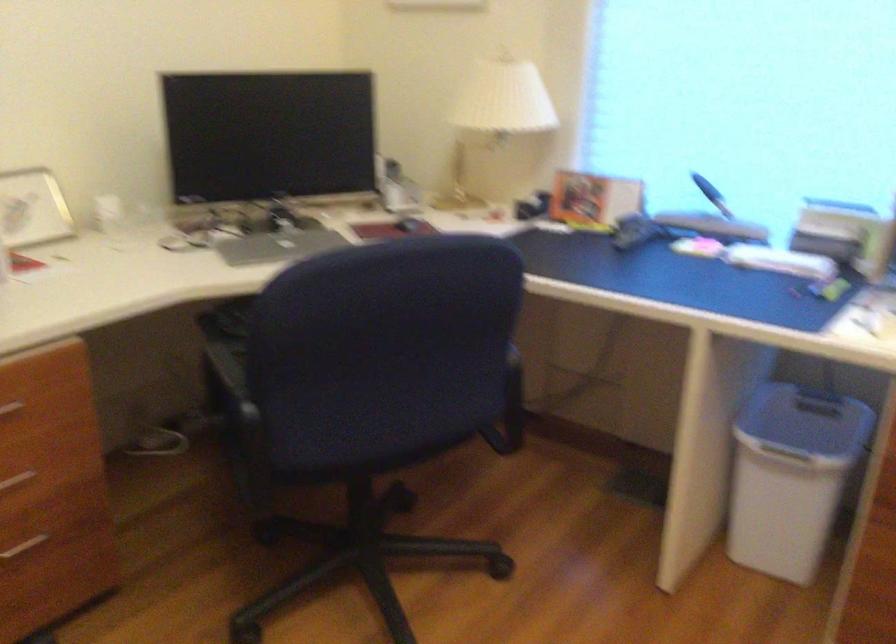
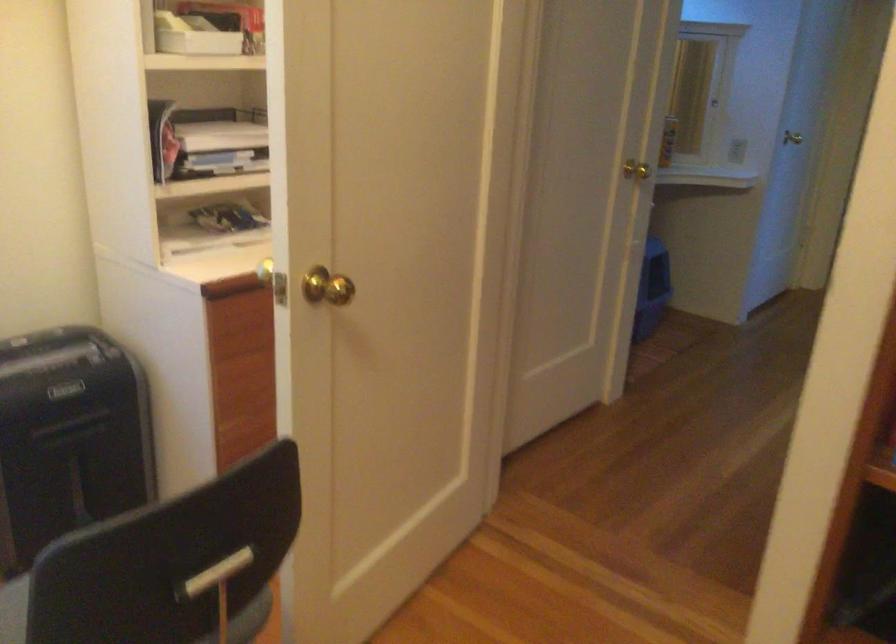
The first image is from the beginning of the video and the second image is from the end. How did the camera likely rotate when shooting the video?

The camera's rotation is toward right-down.